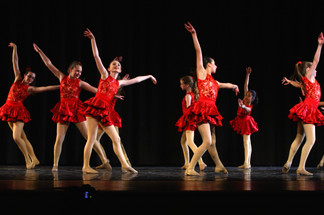
What are the coordinates of `1 stage` in the screenshot? It's located at (264, 185).